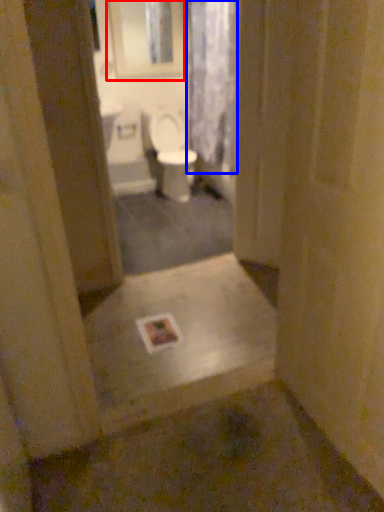
Question: Which point is further to the camera, medicine cabinet (highlighted by a red box) or shower curtain (highlighted by a blue box)?

Choices:
 (A) medicine cabinet
 (B) shower curtain

Answer: (A)